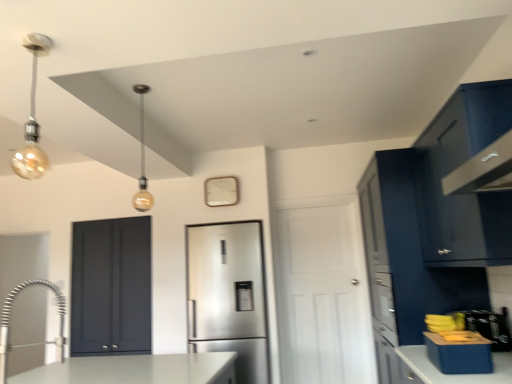
You are a GUI agent. You are given a task and a screenshot of the screen. Output one action in this format:
    pyautogui.click(x=<x>, y=<y>)
    Task: Click on the free space above matte dark blue cabinet at left, the second door positioned from the right (from a real-world perspective)
    The image size is (512, 384).
    Given the screenshot: What is the action you would take?
    pyautogui.click(x=111, y=213)